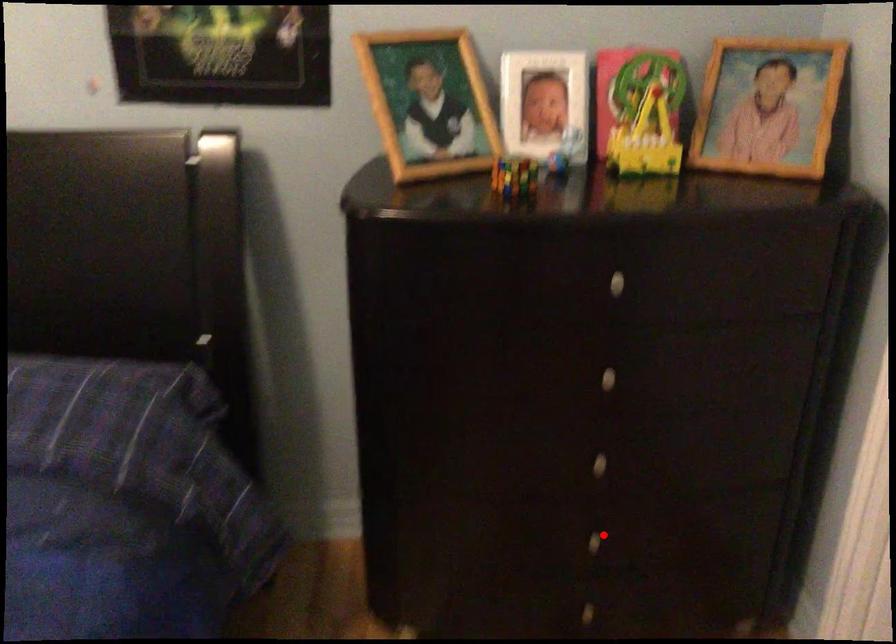
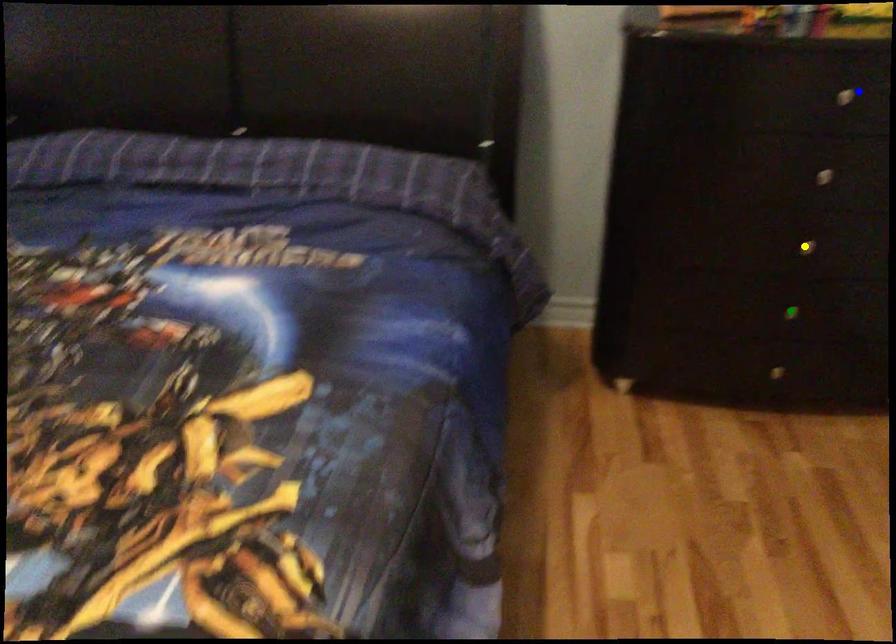
Question: I am providing you with two images of the same scene from different viewpoints. A red point is marked on the first image. You are given multiple points on the second image. Which spot in image 2 lines up with the point in image 1?

Choices:
 (A) yellow point
 (B) blue point
 (C) green point

Answer: (C)